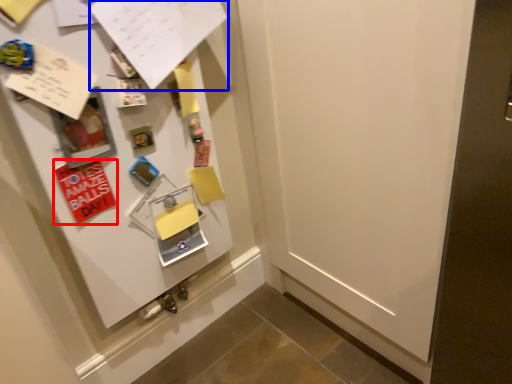
Question: Which point is closer to the camera, postcard (highlighted by a red box) or paper (highlighted by a blue box)?

Choices:
 (A) postcard
 (B) paper

Answer: (B)